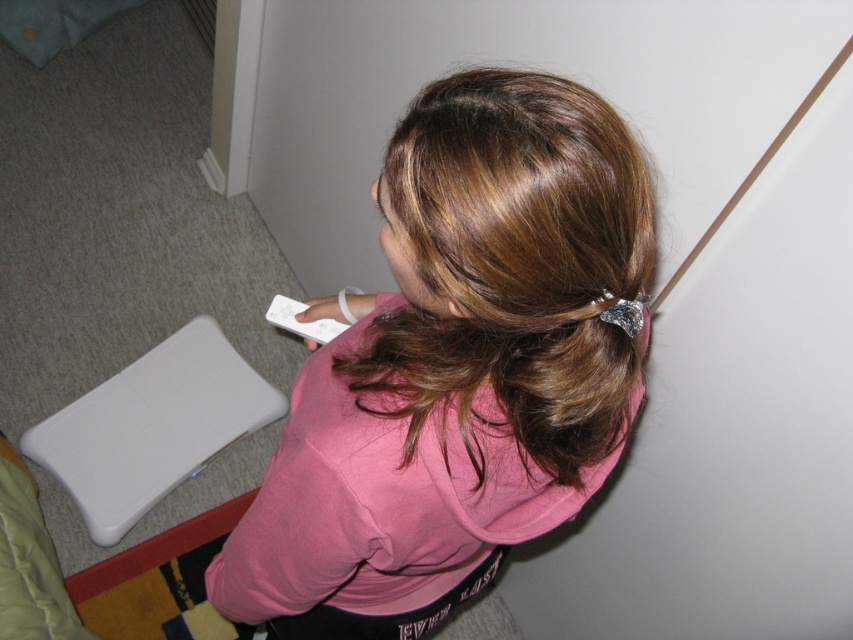
You are a GUI agent. You are given a task and a screenshot of the screen. Output one action in this format:
    pyautogui.click(x=<x>, y=<y>)
    Task: Click on the pink fabric shirt at center
    
    Given the screenshot: What is the action you would take?
    pyautogui.click(x=457, y=365)

Can you confirm if pink fabric shirt at center is taller than white plastic remote at center?

Yes, pink fabric shirt at center is taller than white plastic remote at center.

Which is in front, point (339, 468) or point (277, 310)?

Point (339, 468) is in front.

Where is `pink fabric shirt at center`? This screenshot has height=640, width=853. pink fabric shirt at center is located at coordinates (457, 365).